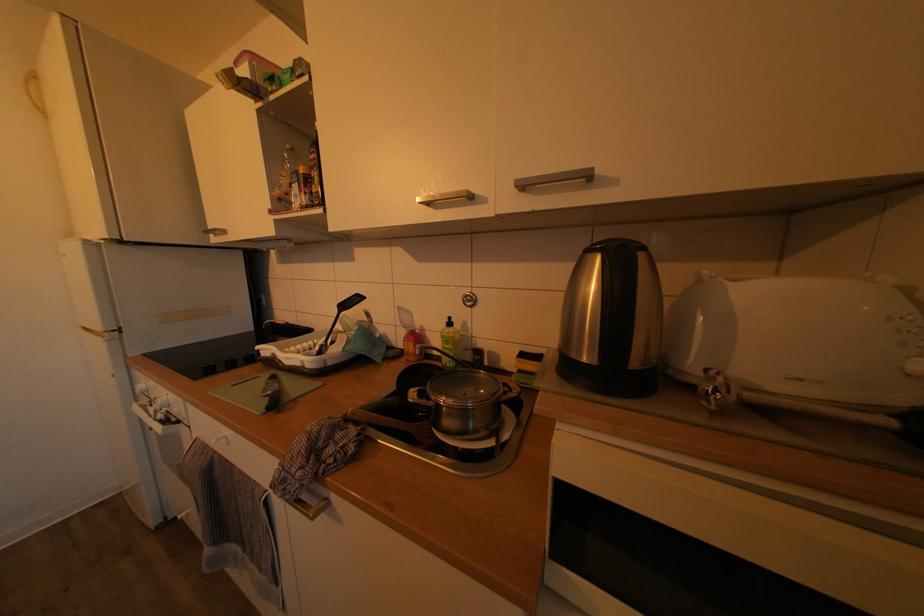
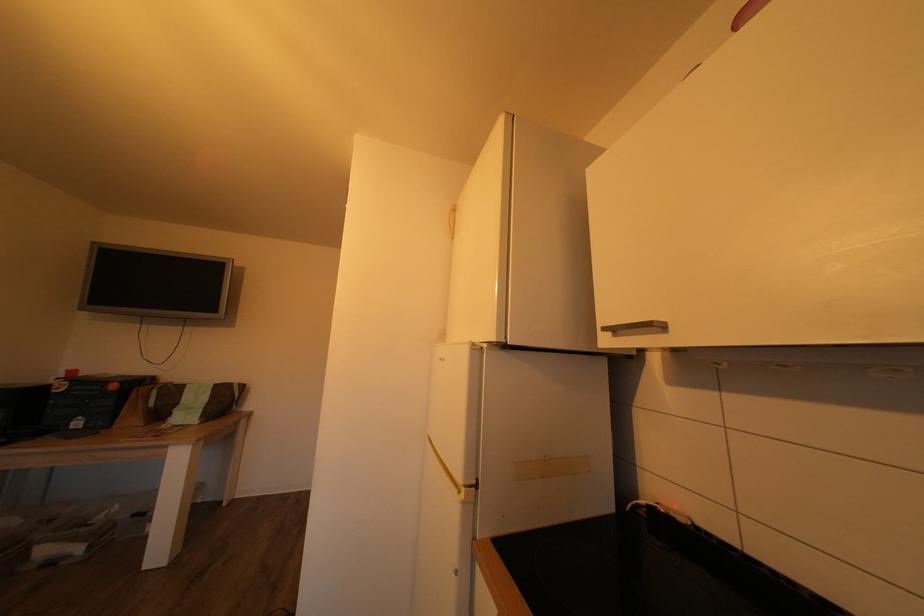
Locate, in the second image, the point that corresponds to point 107,334 in the first image.

(468, 487)